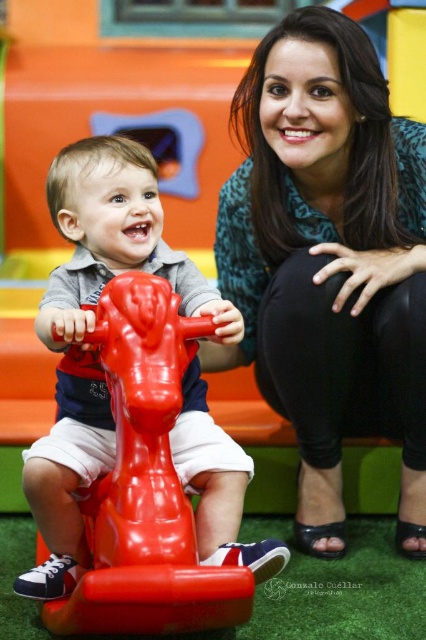
Does matte green blouse at center lie behind rubber toy horse at center?

Yes, it is behind rubber toy horse at center.

Can you confirm if matte green blouse at center is wider than rubber toy horse at center?

Indeed, matte green blouse at center has a greater width compared to rubber toy horse at center.

Is point (325, 464) positioned before point (219, 296)?

No, (325, 464) is behind (219, 296).

Locate an element on the screen. matte green blouse at center is located at coordinates (330, 260).